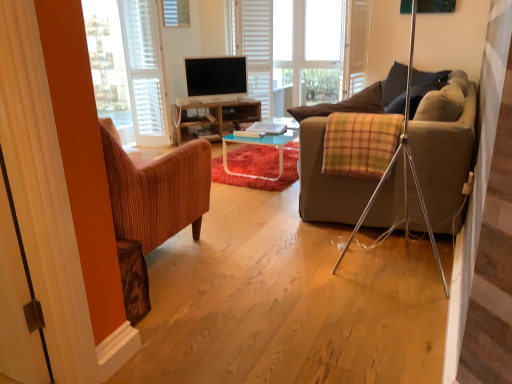
Find the location of a particular element. The image size is (512, 384). white fabric curtain at left is located at coordinates [42, 195].

Find the location of a particular element. white matte blinds at upper center is located at coordinates (145, 71).

This screenshot has height=384, width=512. What do you see at coordinates (361, 144) in the screenshot?
I see `green-yellow plaid blanket at center` at bounding box center [361, 144].

Locate an element on the screen. The height and width of the screenshot is (384, 512). white glossy door at left, positioned as the 1th screen door in bottom-to-top order is located at coordinates (26, 268).

Where is `plaid in front of the white matte blinds at upper center`? plaid in front of the white matte blinds at upper center is located at coordinates (361, 144).

From the picture: Who is smaller, green-yellow plaid blanket at center or white matte blinds at upper center?

green-yellow plaid blanket at center.

Is green-yellow plaid blanket at center further to camera compared to white matte blinds at upper center?

No, green-yellow plaid blanket at center is closer to the camera.

Considering the sizes of objects green-yellow plaid blanket at center and white matte blinds at upper center in the image provided, who is taller, green-yellow plaid blanket at center or white matte blinds at upper center?

Standing taller between the two is white matte blinds at upper center.

Can we say wooden desk at center lies outside white glossy door at left, the second screen door viewed from the back?

Indeed, wooden desk at center is completely outside white glossy door at left, the second screen door viewed from the back.

From a real-world perspective, is wooden desk at center beneath white glossy door at left, the 2th screen door in the top-to-bottom sequence?

Yes, from a real-world perspective, wooden desk at center is below white glossy door at left, the 2th screen door in the top-to-bottom sequence.

How much distance is there between wooden desk at center and white glossy door at left, the first screen door positioned from the left?

wooden desk at center and white glossy door at left, the first screen door positioned from the left, are 3.55 meters apart from each other.

Is wooden desk at center to the left or to the right of white glossy door at left, the first screen door positioned from the left, in the image?

Based on their positions, wooden desk at center is located to the right of white glossy door at left, the first screen door positioned from the left.

Who is bigger, wooden desk at center or dark blue fabric pillow at upper right?

dark blue fabric pillow at upper right.

Which is closer, (186, 139) or (401, 80)?

Point (186, 139).

Can you tell me how much wooden desk at center and dark blue fabric pillow at upper right differ in facing direction?

The facing directions of wooden desk at center and dark blue fabric pillow at upper right are 48.9 degrees apart.

Is wooden desk at center facing towards dark blue fabric pillow at upper right?

No, wooden desk at center is not turned towards dark blue fabric pillow at upper right.

From the image's perspective, between white fabric curtain at left and wooden desk at center, who is located below?

white fabric curtain at left is shown below in the image.

Is white fabric curtain at left to the left or to the right of wooden desk at center in the image?

In the image, white fabric curtain at left appears on the left side of wooden desk at center.

Is white fabric curtain at left positioned in front of wooden desk at center?

Yes, it is.

Which is closer, [147,62] or [180,110]?

Point [147,62].

Can you confirm if white matte blinds at upper center is smaller than wooden desk at center?

Yes, white matte blinds at upper center is smaller than wooden desk at center.

How much distance is there between white matte blinds at upper center and wooden desk at center?

white matte blinds at upper center and wooden desk at center are 54.64 centimeters apart.

Locate an element on the screen. desk that is below the white matte blinds at upper center (from the image's perspective) is located at coordinates (213, 117).

Is white glossy door at left, the 2th screen door in the top-to-bottom sequence, not close to white wooden screen door at upper center, arranged as the second screen door when viewed from the front?

Indeed, white glossy door at left, the 2th screen door in the top-to-bottom sequence, is not near white wooden screen door at upper center, arranged as the second screen door when viewed from the front.

Is white glossy door at left, positioned as the first screen door in front-to-back order, spatially inside white wooden screen door at upper center, the 2th screen door in the left-to-right sequence, or outside of it?

white glossy door at left, positioned as the first screen door in front-to-back order, lies outside white wooden screen door at upper center, the 2th screen door in the left-to-right sequence.

Can you confirm if white glossy door at left, which appears as the second screen door when viewed from the right, is smaller than white wooden screen door at upper center, marked as the first screen door in a top-to-bottom arrangement?

Correct, white glossy door at left, which appears as the second screen door when viewed from the right, occupies less space than white wooden screen door at upper center, marked as the first screen door in a top-to-bottom arrangement.

Who is shorter, white glossy door at left, the second screen door viewed from the back, or white wooden screen door at upper center, acting as the 1th screen door starting from the back?

white glossy door at left, the second screen door viewed from the back, is shorter.

Is green-yellow plaid blanket at center located within wooden desk at center?

No.

From a real-world perspective, is wooden desk at center physically below green-yellow plaid blanket at center?

Correct, in the physical world, wooden desk at center is lower than green-yellow plaid blanket at center.

Which point is more distant from viewer, (183, 118) or (324, 163)?

The point (183, 118) is farther from the camera.

What are the coordinates of `blind above the green-yellow plaid blanket at center (from the image's perspective)` in the screenshot? It's located at (145, 71).

Find the location of `screen door that appears on the left of wooden desk at center`. screen door that appears on the left of wooden desk at center is located at coordinates (26, 268).

Based on their spatial positions, is wooden desk at center or green-yellow plaid blanket at center further from white wooden screen door at upper center, the 2th screen door in the left-to-right sequence?

The object further to white wooden screen door at upper center, the 2th screen door in the left-to-right sequence, is green-yellow plaid blanket at center.

Estimate the real-world distances between objects in this image. Which object is further from matte black tv at center, wooden desk at center or dark blue fabric pillow at upper right?

dark blue fabric pillow at upper right.

Which object lies nearer to the anchor point dark blue fabric pillow at upper right, wooden desk at center or white wooden screen door at upper center, arranged as the second screen door when viewed from the front?

white wooden screen door at upper center, arranged as the second screen door when viewed from the front.

Considering their positions, is white glossy door at left, the second screen door viewed from the back, positioned further to matte black tv at center than wooden desk at center?

Among the two, white glossy door at left, the second screen door viewed from the back, is located further to matte black tv at center.

Looking at the image, which one is located further to green-yellow plaid blanket at center, white wooden screen door at upper center, the 1th screen door from the right, or white matte blinds at upper center?

white matte blinds at upper center.

When comparing their distances from white wooden screen door at upper center, acting as the 1th screen door starting from the back, does white glossy door at left, the second screen door viewed from the back, or white matte blinds at upper center seem closer?

white matte blinds at upper center is closer to white wooden screen door at upper center, acting as the 1th screen door starting from the back.

When comparing their distances from green-yellow plaid blanket at center, does white wooden screen door at upper center, the 1th screen door from the right, or matte black tv at center seem closer?

white wooden screen door at upper center, the 1th screen door from the right, is closer to green-yellow plaid blanket at center.

Which object lies nearer to the anchor point white fabric curtain at left, green-yellow plaid blanket at center or white matte blinds at upper center?

Among the two, green-yellow plaid blanket at center is located nearer to white fabric curtain at left.

Locate an element on the screen. The height and width of the screenshot is (384, 512). screen door situated between matte black tv at center and dark blue fabric pillow at upper right from left to right is located at coordinates (356, 46).

This screenshot has height=384, width=512. I want to click on pillow located between white fabric curtain at left and wooden desk at center in the depth direction, so click(x=394, y=83).

Where is `bay window between white glossy door at left, positioned as the first screen door in front-to-back order, and wooden desk at center in the front-back direction`? This screenshot has width=512, height=384. bay window between white glossy door at left, positioned as the first screen door in front-to-back order, and wooden desk at center in the front-back direction is located at coordinates (301, 43).

Where is `desk located between white matte blinds at upper center and dark blue fabric pillow at upper right in the left-right direction`? The image size is (512, 384). desk located between white matte blinds at upper center and dark blue fabric pillow at upper right in the left-right direction is located at coordinates (213, 117).